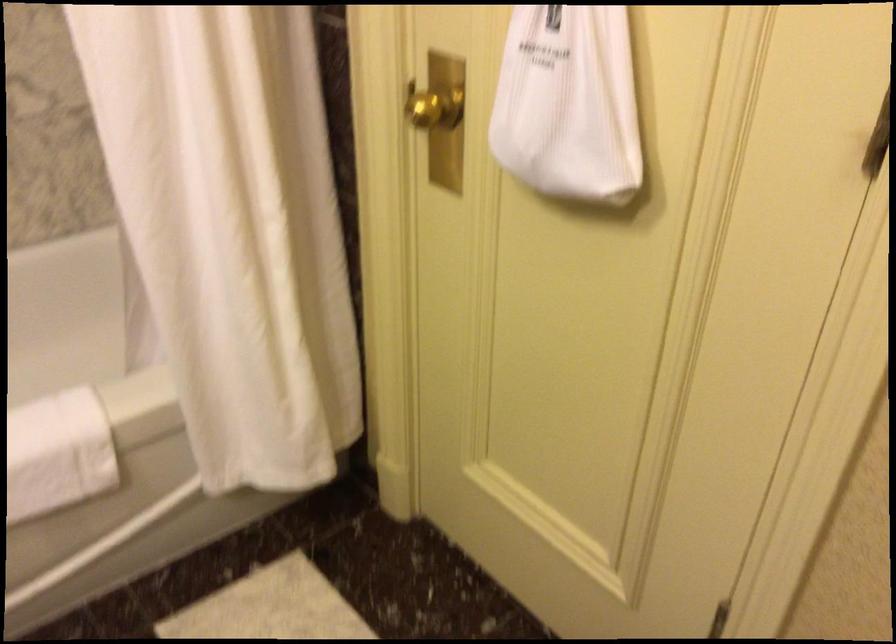
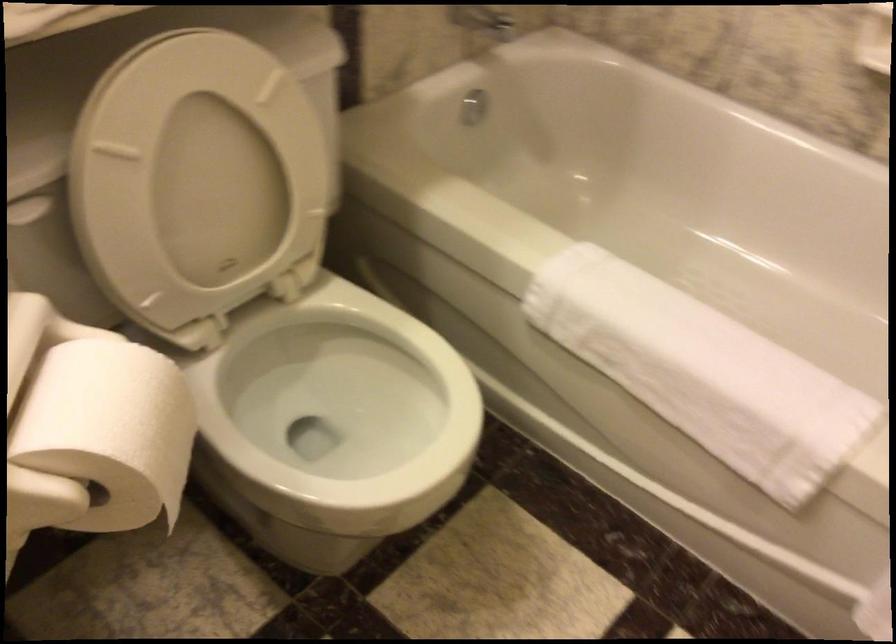
Based on the continuous images, in which direction is the camera rotating?

The camera's rotation is toward left-down.